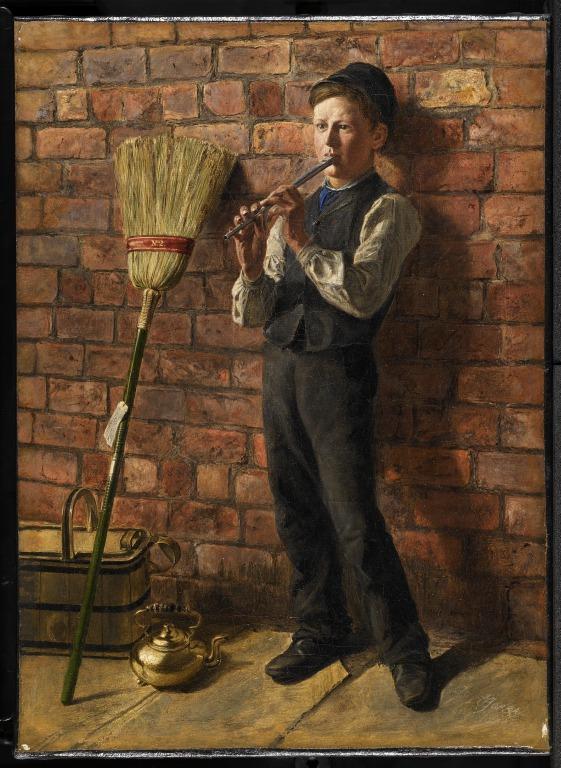
Where is `basket`? The width and height of the screenshot is (561, 768). basket is located at coordinates (57, 576).